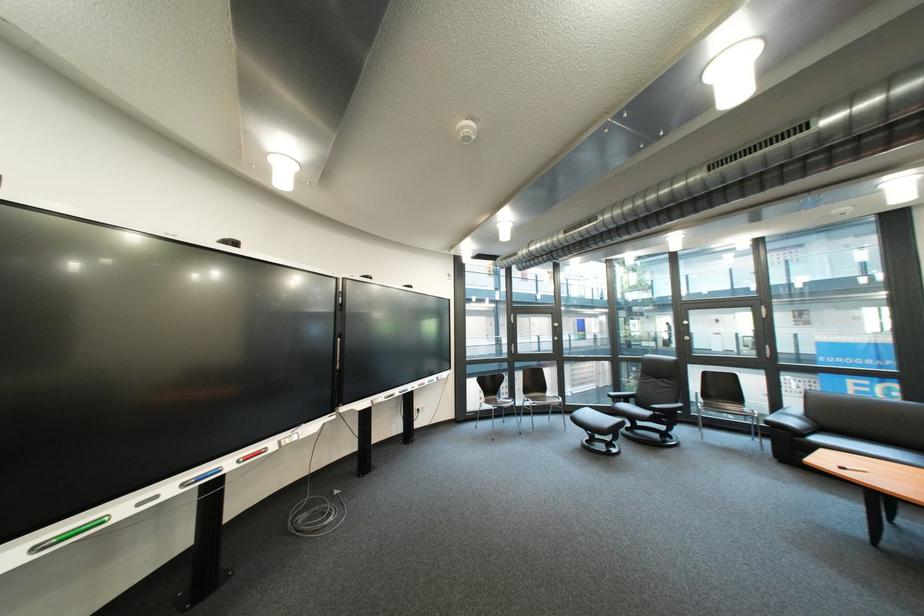
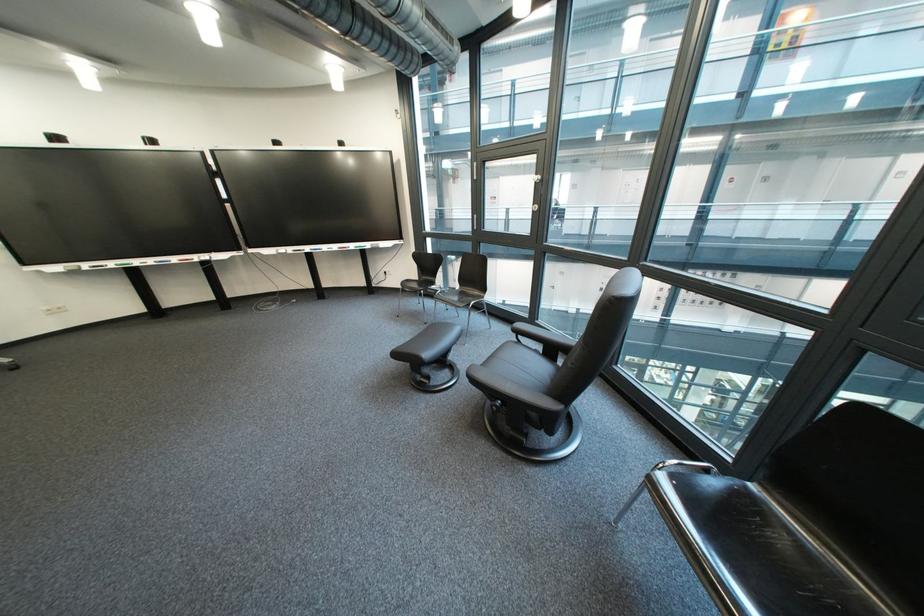
Find the pixel in the second image that matches [533,435] in the first image.

(439, 325)